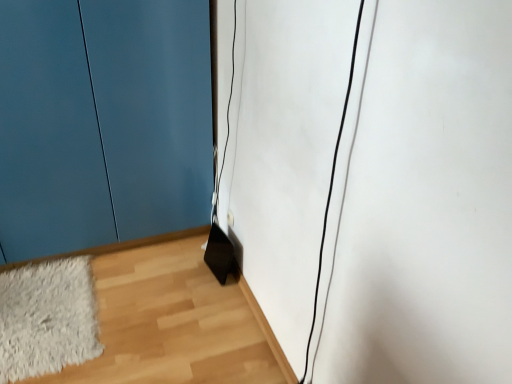
What do you see at coordinates (47, 318) in the screenshot? Image resolution: width=512 pixels, height=384 pixels. I see `white fluffy rug at lower left` at bounding box center [47, 318].

Describe the element at coordinates (174, 319) in the screenshot. I see `wooden floor at lower right` at that location.

This screenshot has height=384, width=512. Identify the location of white fluffy rug at lower left. (47, 318).

Is matte blue door at lower left wider than wooden floor at lower right?

No.

Looking at this image, is matte blue door at lower left inside or outside of wooden floor at lower right?

matte blue door at lower left exists outside the volume of wooden floor at lower right.

Is matte blue door at lower left in front of or behind wooden floor at lower right in the image?

Clearly, matte blue door at lower left is in front of wooden floor at lower right.

Is matte blue door at lower left oriented away from wooden floor at lower right?

No, matte blue door at lower left is not facing the opposite direction of wooden floor at lower right.

From the image's perspective, which is above, white fluffy rug at lower left or wooden floor at lower right?

wooden floor at lower right, from the image's perspective.

From a real-world perspective, who is located higher, white fluffy rug at lower left or wooden floor at lower right?

From a 3D spatial view, white fluffy rug at lower left is above.

Consider the image. Is white fluffy rug at lower left bigger than wooden floor at lower right?

Incorrect, white fluffy rug at lower left is not larger than wooden floor at lower right.

Where is `corridor lying on the right of white fluffy rug at lower left`? corridor lying on the right of white fluffy rug at lower left is located at coordinates (174, 319).

Based on the photo, is matte blue door at lower left located within white fluffy rug at lower left?

No, matte blue door at lower left is not inside white fluffy rug at lower left.

How different are the orientations of white fluffy rug at lower left and matte blue door at lower left in degrees?

There is a 90.5-degree angle between the facing directions of white fluffy rug at lower left and matte blue door at lower left.

Considering the positions of objects white fluffy rug at lower left and matte blue door at lower left in the image provided, who is in front, white fluffy rug at lower left or matte blue door at lower left?

matte blue door at lower left is closer to the camera.

From the image's perspective, does white fluffy rug at lower left appear higher than matte blue door at lower left?

No, from the image's perspective, white fluffy rug at lower left is not above matte blue door at lower left.

Considering the sizes of objects wooden floor at lower right and matte blue door at lower left in the image provided, who is taller, wooden floor at lower right or matte blue door at lower left?

matte blue door at lower left is taller.

Can you confirm if wooden floor at lower right is bigger than matte blue door at lower left?

No, wooden floor at lower right is not bigger than matte blue door at lower left.

Identify the location of door located above the wooden floor at lower right (from a real-world perspective). The height and width of the screenshot is (384, 512). pos(102,122).

Which is closer to the camera, [271,366] or [61,357]?

Point [271,366] is farther from the camera than point [61,357].

Which is behind, wooden floor at lower right or white fluffy rug at lower left?

white fluffy rug at lower left is further away from the camera.

Between wooden floor at lower right and white fluffy rug at lower left, which one appears on the left side from the viewer's perspective?

From the viewer's perspective, white fluffy rug at lower left appears more on the left side.

Between matte blue door at lower left and white fluffy rug at lower left, which one has more height?

matte blue door at lower left.

Considering the positions of objects matte blue door at lower left and white fluffy rug at lower left in the image provided, who is behind, matte blue door at lower left or white fluffy rug at lower left?

white fluffy rug at lower left is further from the camera.

How different are the orientations of matte blue door at lower left and white fluffy rug at lower left in degrees?

90.5 degrees separate the facing orientations of matte blue door at lower left and white fluffy rug at lower left.

From a real-world perspective, is matte blue door at lower left physically above white fluffy rug at lower left?

Yes, from a real-world perspective, matte blue door at lower left is above white fluffy rug at lower left.

Find the location of a particular element. corridor that appears below the matte blue door at lower left (from the image's perspective) is located at coordinates (174, 319).

The image size is (512, 384). What are the coordinates of `mat above the wooden floor at lower right (from a real-world perspective)` in the screenshot? It's located at (47, 318).

Which object lies further to the anchor point matte blue door at lower left, white fluffy rug at lower left or wooden floor at lower right?

The object further to matte blue door at lower left is wooden floor at lower right.

When comparing their distances from white fluffy rug at lower left, does wooden floor at lower right or matte blue door at lower left seem closer?

Based on the image, wooden floor at lower right appears to be nearer to white fluffy rug at lower left.

Based on their spatial positions, is matte blue door at lower left or wooden floor at lower right closer to white fluffy rug at lower left?

Among the two, wooden floor at lower right is located nearer to white fluffy rug at lower left.

Which object lies nearer to the anchor point matte blue door at lower left, wooden floor at lower right or white fluffy rug at lower left?

white fluffy rug at lower left.

Consider the image. When comparing their distances from wooden floor at lower right, does matte blue door at lower left or white fluffy rug at lower left seem closer?

Among the two, white fluffy rug at lower left is located nearer to wooden floor at lower right.

Looking at the image, which one is located closer to wooden floor at lower right, white fluffy rug at lower left or matte blue door at lower left?

white fluffy rug at lower left lies closer to wooden floor at lower right than the other object.

At what (x,y) coordinates should I click in order to perform the action: click on corridor between matte blue door at lower left and white fluffy rug at lower left vertically. Please return your answer as a coordinate pair (x, y). Image resolution: width=512 pixels, height=384 pixels. Looking at the image, I should click on (174, 319).